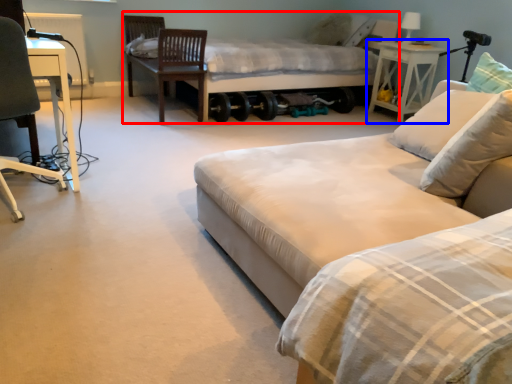
Question: Which point is further to the camera, bed (highlighted by a red box) or nightstand (highlighted by a blue box)?

Choices:
 (A) bed
 (B) nightstand

Answer: (B)